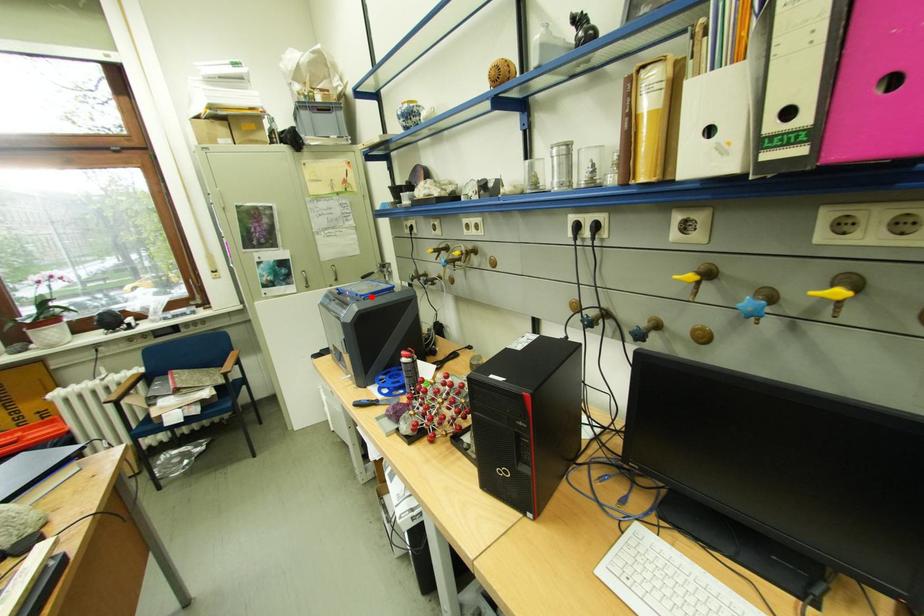
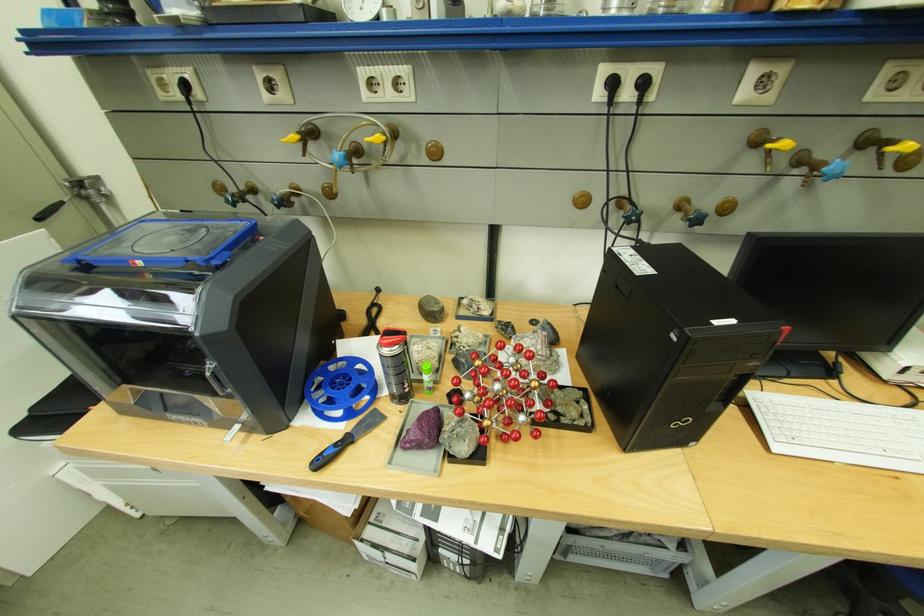
In the second image, find the point that corresponds to the highlighted location in the first image.

(219, 261)